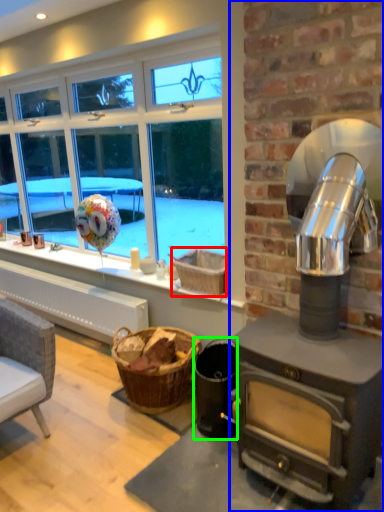
Question: Which is farther away from basket (highlighted by a red box)? fireplace (highlighted by a blue box) or appliance (highlighted by a green box)?

Choices:
 (A) fireplace
 (B) appliance

Answer: (A)